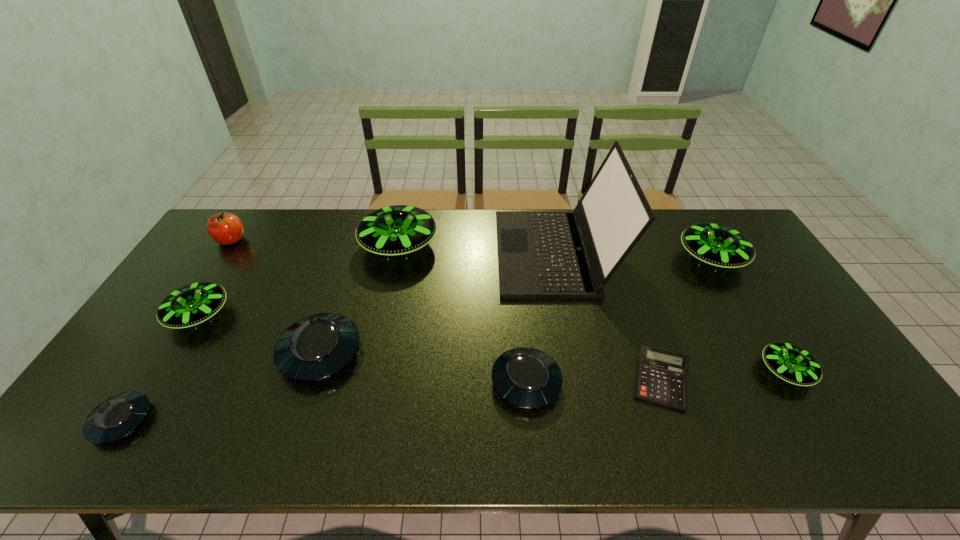
Where is `the tallest object`? the tallest object is located at coordinates (541, 254).

Identify the location of gray laptop. (541, 254).

The width and height of the screenshot is (960, 540). Identify the location of the ninth shortest object. (396, 230).

Image resolution: width=960 pixels, height=540 pixels. In order to click on the tallest saucer in this screenshot , I will do `click(396, 230)`.

Locate an element on the screen. This screenshot has width=960, height=540. the second biggest green saucer is located at coordinates (717, 245).

Locate an element on the screen. This screenshot has width=960, height=540. apple is located at coordinates (224, 228).

Where is `the second smallest green saucer`? The image size is (960, 540). the second smallest green saucer is located at coordinates (192, 304).

You are a GUI agent. You are given a task and a screenshot of the screen. Output one action in this format:
    pyautogui.click(x=<x>, y=<y>)
    Task: Click on the second nearest green saucer
    
    Given the screenshot: What is the action you would take?
    pyautogui.click(x=192, y=304)

The height and width of the screenshot is (540, 960). Find the location of `the second gray saucer from left to right`. the second gray saucer from left to right is located at coordinates (316, 347).

Where is `the nearest green saucer`? This screenshot has width=960, height=540. the nearest green saucer is located at coordinates (791, 363).